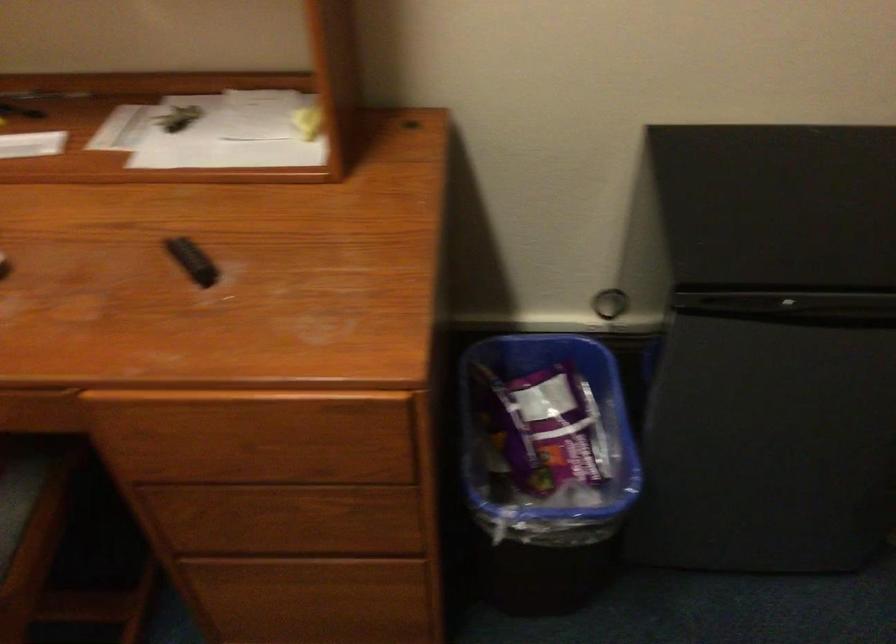
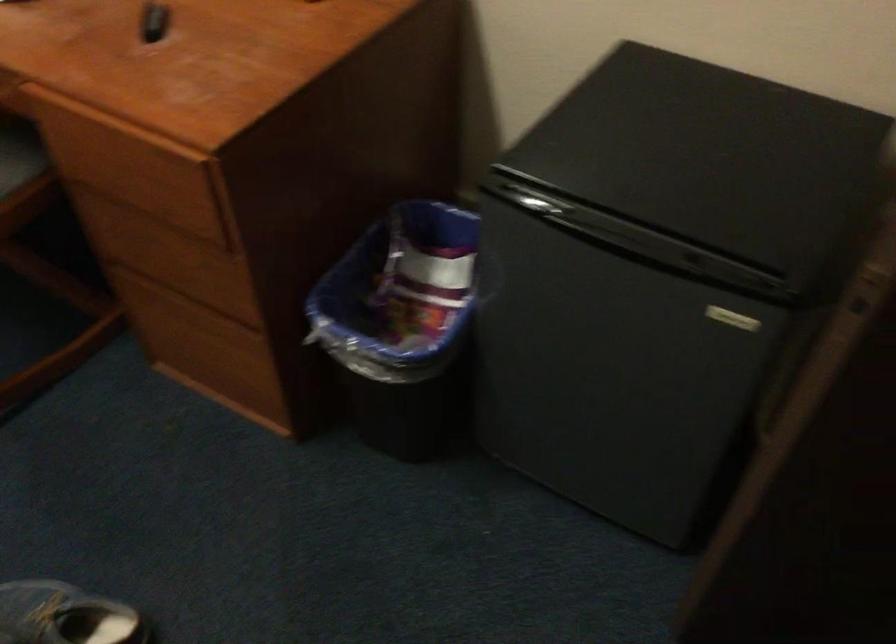
Question: The first image is from the beginning of the video and the second image is from the end. How did the camera likely rotate when shooting the video?

Choices:
 (A) Left
 (B) Right
 (C) Up
 (D) Down

Answer: (A)